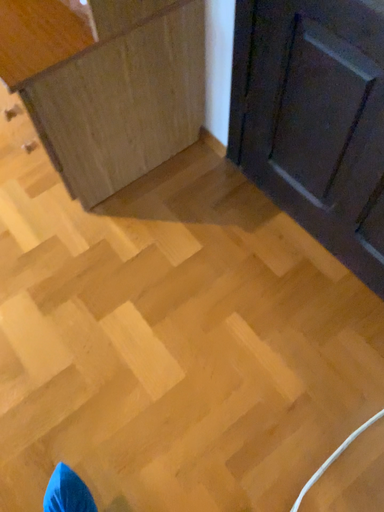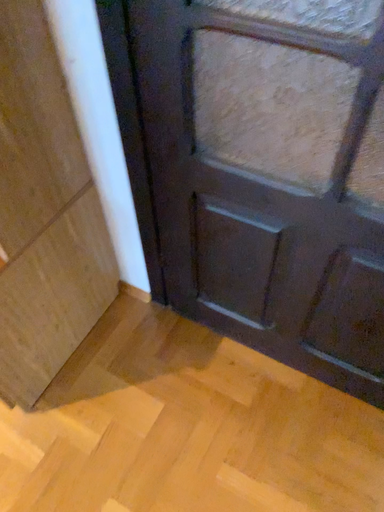
Question: Which way did the camera rotate in the video?

Choices:
 (A) rotated left
 (B) rotated right

Answer: (B)